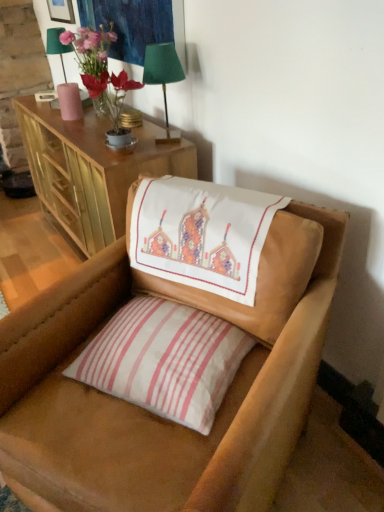
Question: Is leather chair at center located within matte glass vase at upper left?

Choices:
 (A) yes
 (B) no

Answer: (B)

Question: Can we say matte glass vase at upper left lies outside leather chair at center?

Choices:
 (A) yes
 (B) no

Answer: (A)

Question: Is matte glass vase at upper left positioned behind leather chair at center?

Choices:
 (A) yes
 (B) no

Answer: (A)

Question: Considering the relative sizes of matte glass vase at upper left and leather chair at center in the image provided, is matte glass vase at upper left wider than leather chair at center?

Choices:
 (A) yes
 (B) no

Answer: (B)

Question: Is matte glass vase at upper left to the right of leather chair at center from the viewer's perspective?

Choices:
 (A) yes
 (B) no

Answer: (B)

Question: Can you confirm if matte glass vase at upper left is taller than leather chair at center?

Choices:
 (A) yes
 (B) no

Answer: (B)

Question: From a real-world perspective, is green fabric lampshade at upper left, positioned as the second table lamp in front-to-back order, located beneath leather chair at center?

Choices:
 (A) yes
 (B) no

Answer: (B)

Question: Considering the relative positions of green fabric lampshade at upper left, which ranks as the second table lamp in bottom-to-top order, and leather chair at center in the image provided, is green fabric lampshade at upper left, which ranks as the second table lamp in bottom-to-top order, to the right of leather chair at center from the viewer's perspective?

Choices:
 (A) yes
 (B) no

Answer: (B)

Question: Can you confirm if green fabric lampshade at upper left, the 1th table lamp when ordered from top to bottom, is smaller than leather chair at center?

Choices:
 (A) yes
 (B) no

Answer: (A)

Question: Does green fabric lampshade at upper left, the second table lamp in the right-to-left sequence, touch leather chair at center?

Choices:
 (A) yes
 (B) no

Answer: (B)

Question: Is leather chair at center at the back of green fabric lampshade at upper left, acting as the 1th table lamp starting from the back?

Choices:
 (A) yes
 (B) no

Answer: (B)

Question: Is leather chair at center completely or partially inside green fabric lampshade at upper left, acting as the 1th table lamp starting from the back?

Choices:
 (A) yes
 (B) no

Answer: (B)

Question: Is wooden cabinet at upper left surrounding white striped pillow at center?

Choices:
 (A) no
 (B) yes

Answer: (A)